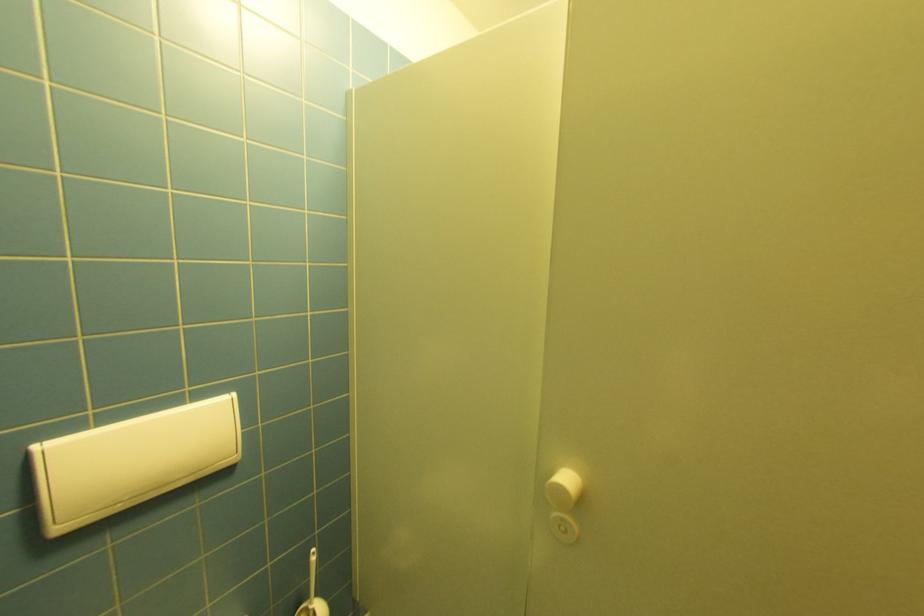
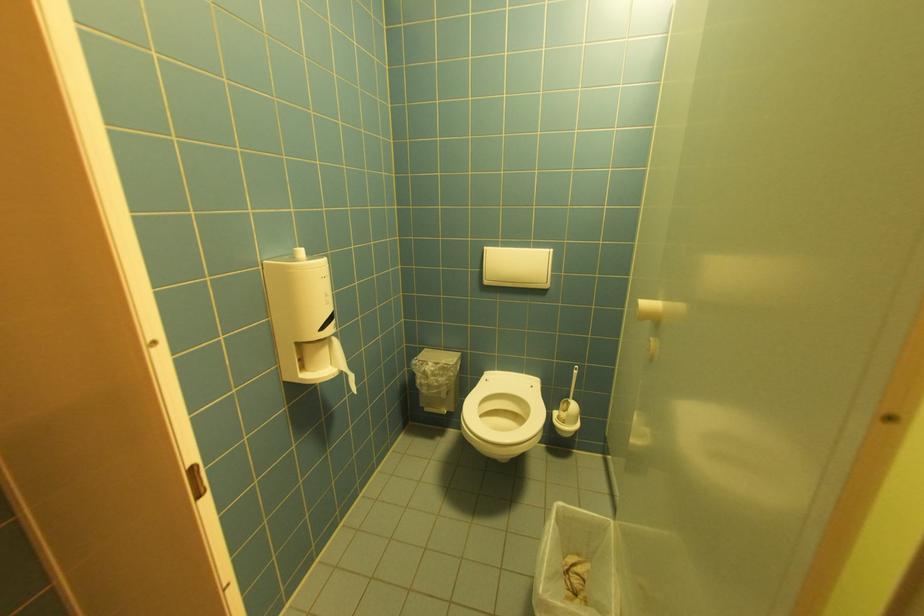
Where in the second image is the point corresponding to pixel 66 530 from the first image?

(492, 283)